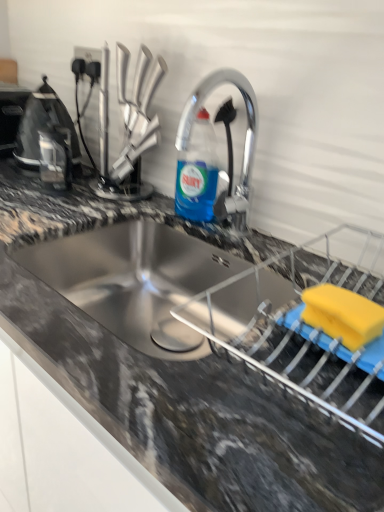
The width and height of the screenshot is (384, 512). Find the location of `granite gray countertop at center`. granite gray countertop at center is located at coordinates (179, 378).

Where is `black plastic kettle at left, the 2th appliance from the top`? The height and width of the screenshot is (512, 384). black plastic kettle at left, the 2th appliance from the top is located at coordinates (43, 128).

What do you see at coordinates (43, 128) in the screenshot? The height and width of the screenshot is (512, 384). I see `black plastic kettle at left, acting as the second appliance starting from the front` at bounding box center [43, 128].

The width and height of the screenshot is (384, 512). I want to click on blue translucent liquid at center, so click(x=197, y=172).

At what (x,y) coordinates should I click in order to perform the action: click on granite gray countertop at center. Please return your answer as a coordinate pair (x, y). This screenshot has width=384, height=512. Looking at the image, I should click on (179, 378).

Is point (209, 165) behind point (9, 142)?

No.

Looking at their sizes, would you say blue translucent liquid at center is wider or thinner than black plastic toaster at left, the first appliance viewed from the left?

In the image, blue translucent liquid at center appears to be more narrow than black plastic toaster at left, the first appliance viewed from the left.

Does blue translucent liquid at center appear on the right side of black plastic toaster at left, the first appliance viewed from the left?

Yes, blue translucent liquid at center is to the right of black plastic toaster at left, the first appliance viewed from the left.

From a real-world perspective, which object rests below the other?

black plastic toaster at left, placed as the 1th appliance when sorted from top to bottom.

Which is closer to the camera, (236,85) or (193,143)?

The point (236,85) is closer to the camera.

From the image's perspective, which is below, metallic silver faucet at upper center or blue translucent liquid at center?

From the image's view, metallic silver faucet at upper center is below.

Identify the location of tap that is above the blue translucent liquid at center (from a real-world perspective). The image size is (384, 512). (227, 141).

Which is behind, metallic silver faucet at upper center or blue translucent liquid at center?

blue translucent liquid at center.

Between point (351, 442) and point (248, 106), which one is positioned in front?

The point (351, 442) is closer to the camera.

In the scene shown: Considering the sizes of objects granite gray countertop at center and metallic silver faucet at upper center in the image provided, who is smaller, granite gray countertop at center or metallic silver faucet at upper center?

metallic silver faucet at upper center.

Does granite gray countertop at center come behind metallic silver faucet at upper center?

No, the depth of granite gray countertop at center is less than that of metallic silver faucet at upper center.

Is granite gray countertop at center far from black plastic kettle at left, arranged as the 2th appliance when viewed from the back?

That's not correct — granite gray countertop at center is a little close to black plastic kettle at left, arranged as the 2th appliance when viewed from the back.

Is granite gray countertop at center aimed at black plastic kettle at left, acting as the second appliance starting from the front?

No, granite gray countertop at center is not turned towards black plastic kettle at left, acting as the second appliance starting from the front.

Considering the positions of point (308, 415) and point (22, 148), is point (308, 415) closer or farther from the camera than point (22, 148)?

Point (308, 415) is closer to the camera than point (22, 148).

Which object is thinner, black plastic toaster at left, placed as the 1th appliance when sorted from top to bottom, or blue translucent liquid at center?

blue translucent liquid at center.

From the image's perspective, which one is positioned lower, black plastic toaster at left, acting as the third appliance starting from the bottom, or blue translucent liquid at center?

blue translucent liquid at center appears lower in the image.

Is black plastic toaster at left, positioned as the first appliance in back-to-front order, positioned far away from blue translucent liquid at center?

No, black plastic toaster at left, positioned as the first appliance in back-to-front order, is not far away from blue translucent liquid at center.

From the image's perspective, which is above, blue translucent liquid at center or granite gray countertop at center?

blue translucent liquid at center is shown above in the image.

Between blue translucent liquid at center and granite gray countertop at center, which one has less height?

With less height is blue translucent liquid at center.

Looking at this image, are blue translucent liquid at center and granite gray countertop at center making contact?

blue translucent liquid at center is not next to granite gray countertop at center, and they're not touching.

Is granite gray countertop at center completely or partially inside blue translucent liquid at center?

No, granite gray countertop at center is not surrounded by blue translucent liquid at center.

Between yellow sponge at lower right, positioned as the 1th appliance in bottom-to-top order, and metallic silver faucet at upper center, which one appears on the right side from the viewer's perspective?

Positioned to the right is yellow sponge at lower right, positioned as the 1th appliance in bottom-to-top order.

Is yellow sponge at lower right, positioned as the 1th appliance in bottom-to-top order, wider or thinner than metallic silver faucet at upper center?

yellow sponge at lower right, positioned as the 1th appliance in bottom-to-top order, is wider than metallic silver faucet at upper center.

In the scene shown: From a real-world perspective, is yellow sponge at lower right, which is the 3th appliance from back to front, physically located above or below metallic silver faucet at upper center?

From a real-world perspective, yellow sponge at lower right, which is the 3th appliance from back to front, is physically below metallic silver faucet at upper center.

In order to click on tap behind the yellow sponge at lower right, which is the 3th appliance from back to front in this screenshot , I will do `click(227, 141)`.

What are the coordinates of `bottle in front of the black plastic toaster at left, positioned as the first appliance in back-to-front order` in the screenshot? It's located at (197, 172).

The width and height of the screenshot is (384, 512). In the image, there is a metallic silver faucet at upper center. What are the coordinates of `bottle below it (from a real-world perspective)` in the screenshot? It's located at click(197, 172).

Looking at the image, which one is located further to granite gray countertop at center, black plastic toaster at left, acting as the third appliance starting from the bottom, or yellow sponge at lower right, acting as the first appliance starting from the right?

black plastic toaster at left, acting as the third appliance starting from the bottom.

When comparing their distances from black plastic toaster at left, which is the 3th appliance from front to back, does black plastic kettle at left, the 2th appliance from the top, or blue translucent liquid at center seem closer?

black plastic kettle at left, the 2th appliance from the top, is positioned closer to the anchor black plastic toaster at left, which is the 3th appliance from front to back.

Which object lies nearer to the anchor point black plastic toaster at left, the first appliance viewed from the left, granite gray countertop at center or black plastic kettle at left, the 2th appliance from the top?

black plastic kettle at left, the 2th appliance from the top.

Looking at the image, which one is located further to black plastic toaster at left, arranged as the third appliance when viewed from the right, blue translucent liquid at center or metallic silver faucet at upper center?

metallic silver faucet at upper center.

From the picture: Considering their positions, is black plastic kettle at left, the second appliance from the bottom, positioned closer to blue translucent liquid at center than granite gray countertop at center?

granite gray countertop at center.

Considering their positions, is yellow sponge at lower right, the first appliance positioned from the front, positioned further to blue translucent liquid at center than black plastic kettle at left, the second appliance from the bottom?

black plastic kettle at left, the second appliance from the bottom, is positioned further to the anchor blue translucent liquid at center.

Based on their spatial positions, is granite gray countertop at center or black plastic toaster at left, acting as the third appliance starting from the bottom, further from black plastic kettle at left, the 2th appliance from the top?

granite gray countertop at center is positioned further to the anchor black plastic kettle at left, the 2th appliance from the top.

From the image, which object appears to be nearer to metallic silver faucet at upper center, granite gray countertop at center or yellow sponge at lower right, acting as the first appliance starting from the right?

granite gray countertop at center is positioned closer to the anchor metallic silver faucet at upper center.

Identify the location of bottle between granite gray countertop at center and black plastic toaster at left, arranged as the third appliance when viewed from the right, along the z-axis. This screenshot has width=384, height=512. (197, 172).

Locate an element on the screen. countertop located between yellow sponge at lower right, acting as the first appliance starting from the right, and black plastic toaster at left, positioned as the first appliance in back-to-front order, in the depth direction is located at coordinates (179, 378).

In order to click on bottle between black plastic kettle at left, acting as the second appliance starting from the front, and metallic silver faucet at upper center, in the horizontal direction in this screenshot , I will do `click(197, 172)`.

The image size is (384, 512). What are the coordinates of `appliance situated between granite gray countertop at center and metallic silver faucet at upper center from left to right` in the screenshot? It's located at (43, 128).